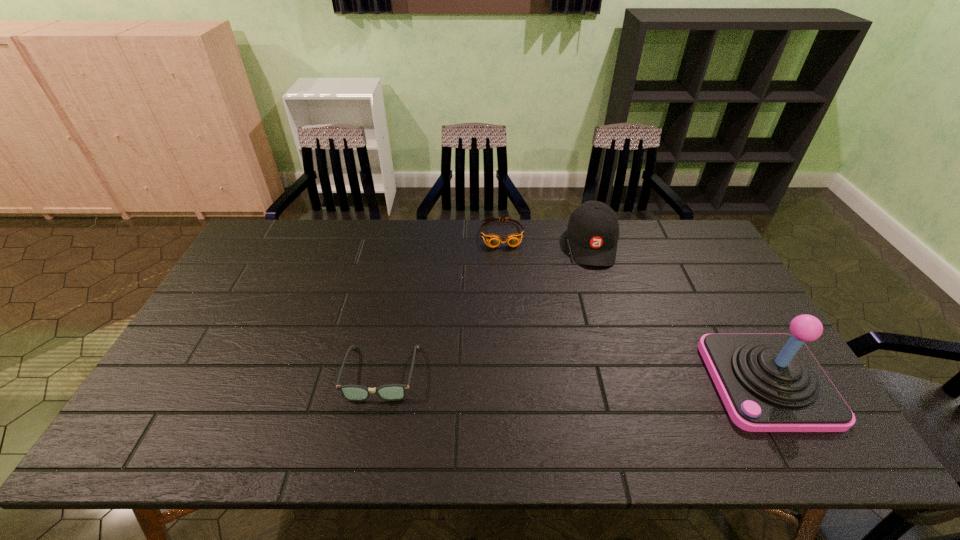
Locate an element on the screen. vacant space on the desktop that is between the spectacles and the tallest object and is positioned with a logo on the front of the baseball cap is located at coordinates (613, 379).

The image size is (960, 540). I want to click on vacant spot on the desktop that is between the leftmost object and the joystick and is positioned with the lenses facing forward on the shortest object, so click(522, 376).